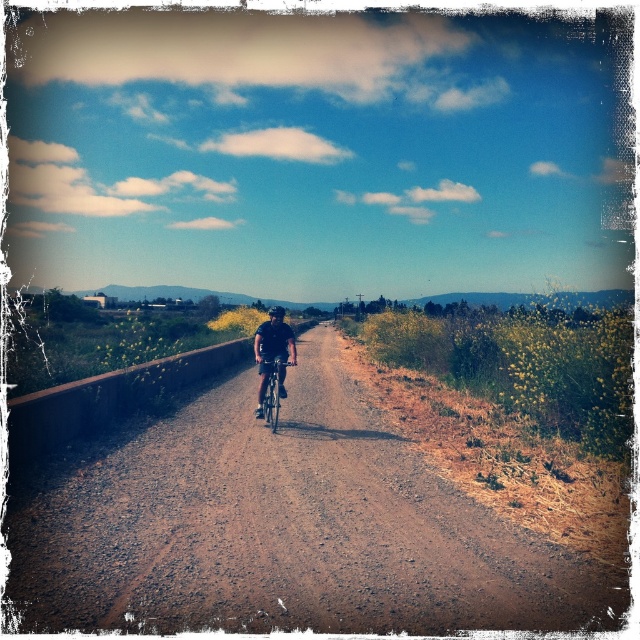
Question: Observing the image, what is the correct spatial positioning of brown gravel road at center in reference to black matte bicycle helmet at center?

Choices:
 (A) below
 (B) above

Answer: (A)

Question: Is brown gravel road at center bigger than shiny metallic bicycle at center?

Choices:
 (A) no
 (B) yes

Answer: (B)

Question: Which object appears farthest from the camera in this image?

Choices:
 (A) black matte bicycle at center
 (B) shiny metallic bicycle at center
 (C) brown gravel road at center

Answer: (B)

Question: Is shiny metallic bicycle at center wider than black matte bicycle helmet at center?

Choices:
 (A) no
 (B) yes

Answer: (A)

Question: Estimate the real-world distances between objects in this image. Which object is closer to the black matte bicycle at center?

Choices:
 (A) black matte bicycle helmet at center
 (B) brown gravel road at center
 (C) shiny metallic bicycle at center

Answer: (C)

Question: Which of the following is the closest to the observer?

Choices:
 (A) (278, 305)
 (B) (268, 394)
 (C) (70, 592)

Answer: (C)